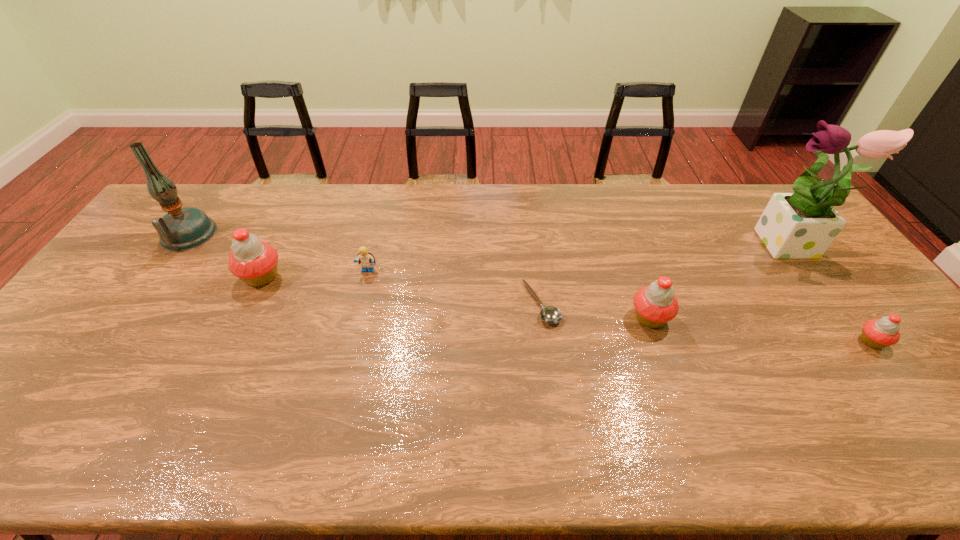
The height and width of the screenshot is (540, 960). Find the location of `free space between the second object from left to right and the third object from left to right`. free space between the second object from left to right and the third object from left to right is located at coordinates (315, 274).

The width and height of the screenshot is (960, 540). What are the coordinates of `free space between the leftmost object and the Lego` in the screenshot? It's located at (277, 253).

Identify the location of vacant space in between the Lego and the tallest object. The height and width of the screenshot is (540, 960). (579, 259).

Find the location of a particular element. The width and height of the screenshot is (960, 540). blank region between the flower arrangement and the second tallest object is located at coordinates (490, 241).

Find the location of `unoccupied position between the shortest object and the sixth object from right to left`. unoccupied position between the shortest object and the sixth object from right to left is located at coordinates (401, 290).

Image resolution: width=960 pixels, height=540 pixels. Find the location of `free space between the flower arrangement and the rightmost cupcake`. free space between the flower arrangement and the rightmost cupcake is located at coordinates (831, 294).

At what (x,y) coordinates should I click in order to perform the action: click on empty space that is in between the leftmost cupcake and the shortest cupcake. Please return your answer as a coordinate pair (x, y). This screenshot has width=960, height=540. Looking at the image, I should click on (566, 309).

Image resolution: width=960 pixels, height=540 pixels. Find the location of `free space between the shortest cupcake and the third object from right to left`. free space between the shortest cupcake and the third object from right to left is located at coordinates (760, 329).

Find the location of a particular element. This screenshot has width=960, height=540. vacant area that lies between the flower arrangement and the rightmost cupcake is located at coordinates (831, 294).

Choose which object is the fifth nearest neighbor to the ladle. Please provide its 2D coordinates. Your answer should be formatted as a tuple, i.e. [(x, y)], where the tuple contains the x and y coordinates of a point satisfying the conditions above.

[(877, 333)]